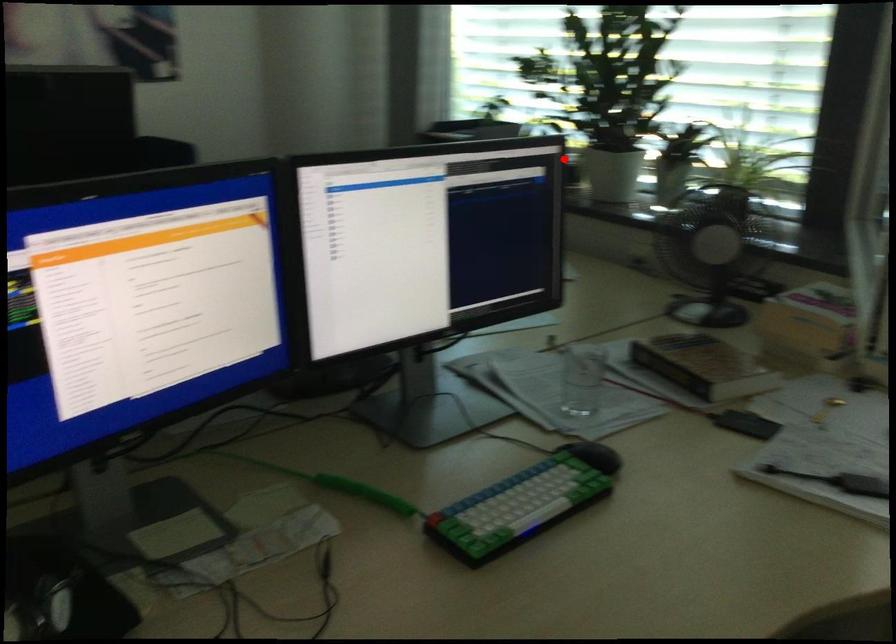
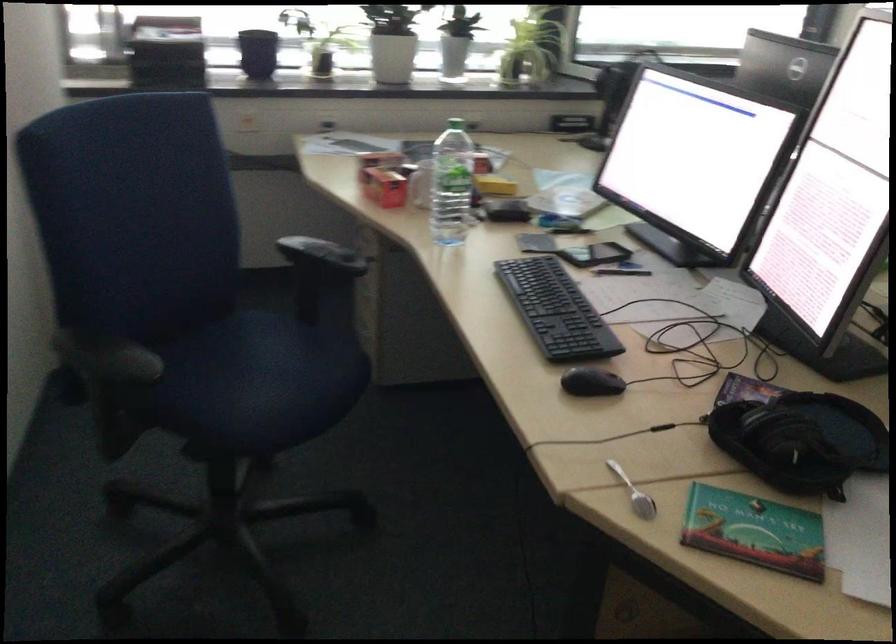
Locate, in the second image, the point that corresponds to the highlighted location in the first image.

(257, 53)